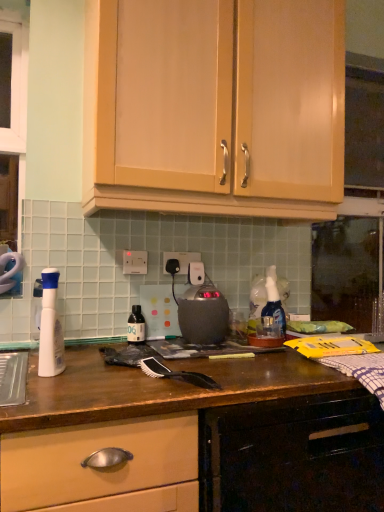
Describe the element at coordinates (135, 262) in the screenshot. This screenshot has width=384, height=512. I see `white plastic electric outlet at center, positioned as the 2th electric outlet in right-to-left order` at that location.

This screenshot has height=512, width=384. In order to click on wooden drawer at lower left, marked as the second cabinetry in a top-to-bottom arrangement in this screenshot , I will do `click(294, 455)`.

The image size is (384, 512). Describe the element at coordinates (50, 328) in the screenshot. I see `white plastic spray bottle at left` at that location.

What is the approximate height of black plastic electric outlet at center, which is the second electric outlet in left-to-right order?

It is 4.00 inches.

In order to face matte wood cabinets at upper center, which is the 1th cabinetry from top to bottom, should I rotate leftwards or rightwards?

Turn right approximately 3.291 degrees to face it.

In order to click on matte wood cabinets at upper center, which is the 1th cabinetry from top to bottom in this screenshot , I will do `click(215, 106)`.

Locate an element on the screen. This screenshot has height=512, width=384. white plastic electric outlet at center, acting as the second electric outlet starting from the back is located at coordinates (135, 262).

In the scene shown: Is white plastic spray bottle at left positioned beyond the bounds of wooden drawer at lower left, the 1th cabinetry when ordered from bottom to top?

Yes, white plastic spray bottle at left is outside of wooden drawer at lower left, the 1th cabinetry when ordered from bottom to top.

Considering the relative positions of white plastic spray bottle at left and wooden drawer at lower left, the 1th cabinetry when ordered from bottom to top, in the image provided, is white plastic spray bottle at left in front of wooden drawer at lower left, the 1th cabinetry when ordered from bottom to top,?

No, white plastic spray bottle at left is further to the viewer.

Consider the image. Could you measure the distance between white plastic spray bottle at left and wooden drawer at lower left, the 1th cabinetry when ordered from bottom to top?

They are 56.70 centimeters apart.

Considering the sizes of objects white plastic spray bottle at left and wooden drawer at lower left, the 1th cabinetry when ordered from bottom to top, in the image provided, who is shorter, white plastic spray bottle at left or wooden drawer at lower left, the 1th cabinetry when ordered from bottom to top,?

white plastic spray bottle at left.

Is the depth of satin black kettle at center less than that of translucent plastic bottle at center?

That is True.

Is satin black kettle at center positioned far away from translucent plastic bottle at center?

satin black kettle at center is near translucent plastic bottle at center, not far away.

Considering the positions of objects satin black kettle at center and translucent plastic bottle at center in the image provided, who is more to the left, satin black kettle at center or translucent plastic bottle at center?

From the viewer's perspective, translucent plastic bottle at center appears more on the left side.

Consider the image. Is satin black kettle at center thinner than translucent plastic bottle at center?

In fact, satin black kettle at center might be wider than translucent plastic bottle at center.

Which object is further away from the camera, white plastic electric outlet at center, arranged as the first electric outlet when viewed from the left, or satin black kettle at center?

white plastic electric outlet at center, arranged as the first electric outlet when viewed from the left, is more distant.

Is satin black kettle at center inside white plastic electric outlet at center, the 1th electric outlet viewed from the front?

No, satin black kettle at center is located outside of white plastic electric outlet at center, the 1th electric outlet viewed from the front.

The width and height of the screenshot is (384, 512). Find the location of `home appliance below the white plastic electric outlet at center, acting as the second electric outlet starting from the back (from the image's perspective)`. home appliance below the white plastic electric outlet at center, acting as the second electric outlet starting from the back (from the image's perspective) is located at coordinates (203, 315).

Can you tell me how much white plastic electric outlet at center, positioned as the 2th electric outlet in right-to-left order, and satin black kettle at center differ in facing direction?

The angular difference between white plastic electric outlet at center, positioned as the 2th electric outlet in right-to-left order, and satin black kettle at center is 0.0152 degrees.

Can you tell me how much black synthetic brush at center and satin black kettle at center differ in facing direction?

They differ by 28.2 degrees in their facing directions.

Looking at this image, is black synthetic brush at center facing away from satin black kettle at center?

black synthetic brush at center is not turned away from satin black kettle at center.

Considering the sizes of black synthetic brush at center and satin black kettle at center in the image, is black synthetic brush at center bigger or smaller than satin black kettle at center?

Considering their sizes, black synthetic brush at center takes up less space than satin black kettle at center.

From the image's perspective, is black synthetic brush at center beneath satin black kettle at center?

Correct, black synthetic brush at center appears lower than satin black kettle at center in the image.

Does translucent plastic bottle at center have a smaller size compared to white plastic electric outlet at center, the 1th electric outlet viewed from the front?

No, translucent plastic bottle at center is not smaller than white plastic electric outlet at center, the 1th electric outlet viewed from the front.

From a real-world perspective, is translucent plastic bottle at center positioned above or below white plastic electric outlet at center, the 1th electric outlet viewed from the front?

Clearly, from a real-world perspective, translucent plastic bottle at center is below white plastic electric outlet at center, the 1th electric outlet viewed from the front.

Does black synthetic brush at center turn towards wooden drawer at lower left, the 1th cabinetry when ordered from bottom to top?

No, black synthetic brush at center is not facing towards wooden drawer at lower left, the 1th cabinetry when ordered from bottom to top.

Would you consider black synthetic brush at center to be distant from wooden drawer at lower left, marked as the second cabinetry in a top-to-bottom arrangement?

No, black synthetic brush at center is not far away from wooden drawer at lower left, marked as the second cabinetry in a top-to-bottom arrangement.

Find the location of a particular element. This screenshot has height=512, width=384. cabinetry that is in front of the black synthetic brush at center is located at coordinates (294, 455).

Is wooden drawer at lower left, the 1th cabinetry when ordered from bottom to top, bigger than white plastic spray bottle at left?

Correct, wooden drawer at lower left, the 1th cabinetry when ordered from bottom to top, is larger in size than white plastic spray bottle at left.

Is wooden drawer at lower left, the 1th cabinetry when ordered from bottom to top, at the left side of white plastic spray bottle at left?

No.

From the image's perspective, which is above, wooden drawer at lower left, the 1th cabinetry when ordered from bottom to top, or white plastic spray bottle at left?

From the image's view, white plastic spray bottle at left is above.

Identify the location of cabinetry below the white plastic spray bottle at left (from the image's perspective). This screenshot has height=512, width=384. [x=294, y=455].

Find the location of a particular element. The image size is (384, 512). home appliance that appears above the translucent plastic bottle at center (from the image's perspective) is located at coordinates (203, 315).

Considering their positions, is black plastic electric outlet at center, which is the first electric outlet from back to front, positioned further to wooden drawer at lower left, the 1th cabinetry when ordered from bottom to top, than white plastic spray bottle at left?

The object further to wooden drawer at lower left, the 1th cabinetry when ordered from bottom to top, is black plastic electric outlet at center, which is the first electric outlet from back to front.

Estimate the real-world distances between objects in this image. Which object is further from translucent plastic bottle at center, black synthetic brush at center or matte wood cabinets at upper center, which is the 1th cabinetry from top to bottom?

The object further to translucent plastic bottle at center is matte wood cabinets at upper center, which is the 1th cabinetry from top to bottom.

From the image, which object appears to be farther from black plastic electric outlet at center, which is the first electric outlet from back to front, wooden drawer at lower left, the 1th cabinetry when ordered from bottom to top, or white plastic spray bottle at left?

The object further to black plastic electric outlet at center, which is the first electric outlet from back to front, is wooden drawer at lower left, the 1th cabinetry when ordered from bottom to top.

Considering their positions, is white plastic electric outlet at center, the 1th electric outlet viewed from the front, positioned further to wooden drawer at lower left, marked as the second cabinetry in a top-to-bottom arrangement, than satin black kettle at center?

white plastic electric outlet at center, the 1th electric outlet viewed from the front, is further to wooden drawer at lower left, marked as the second cabinetry in a top-to-bottom arrangement.

When comparing their distances from white plastic electric outlet at center, acting as the second electric outlet starting from the back, does black synthetic brush at center or white plastic spray bottle at left seem further?

The object further to white plastic electric outlet at center, acting as the second electric outlet starting from the back, is black synthetic brush at center.

Based on their spatial positions, is white plastic spray bottle at left or black synthetic brush at center further from matte wood cabinets at upper center, which is the 1th cabinetry from top to bottom?

black synthetic brush at center is further to matte wood cabinets at upper center, which is the 1th cabinetry from top to bottom.

Considering their positions, is matte wood cabinets at upper center, the 2th cabinetry when ordered from bottom to top, positioned further to black synthetic brush at center than wooden drawer at lower left, the 1th cabinetry when ordered from bottom to top?

Based on the image, matte wood cabinets at upper center, the 2th cabinetry when ordered from bottom to top, appears to be further to black synthetic brush at center.

Considering their positions, is satin black kettle at center positioned closer to black plastic electric outlet at center, which is the second electric outlet in left-to-right order, than translucent plastic bottle at center?

The object closer to black plastic electric outlet at center, which is the second electric outlet in left-to-right order, is satin black kettle at center.

Locate an element on the screen. home appliance positioned between black synthetic brush at center and translucent plastic bottle at center from near to far is located at coordinates pyautogui.click(x=203, y=315).

Image resolution: width=384 pixels, height=512 pixels. In order to click on home appliance between matte wood cabinets at upper center, the 2th cabinetry when ordered from bottom to top, and black synthetic brush at center in the up-down direction in this screenshot , I will do `click(203, 315)`.

The width and height of the screenshot is (384, 512). I want to click on brush between wooden drawer at lower left, the 1th cabinetry when ordered from bottom to top, and white plastic electric outlet at center, the 1th electric outlet viewed from the front, from front to back, so click(x=177, y=374).

Identify the location of electric outlet between white plastic electric outlet at center, the 1th electric outlet viewed from the front, and translucent plastic bottle at center, in the vertical direction. (181, 260).